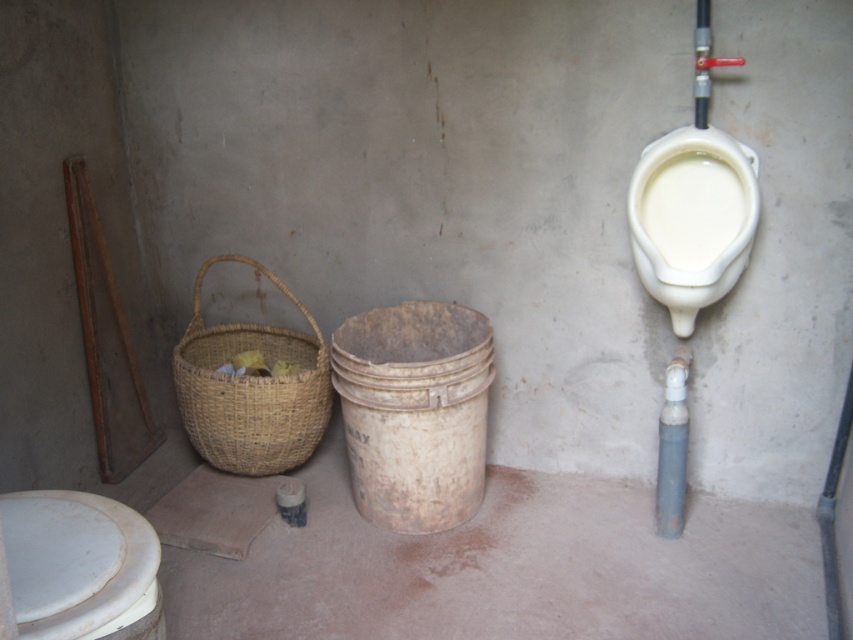
Which is in front, point (85, 563) or point (746, 168)?

Point (85, 563)

Does point (96, 608) come closer to viewer compared to point (753, 227)?

Yes, point (96, 608) is closer to viewer.

What do you see at coordinates (80, 566) in the screenshot? This screenshot has height=640, width=853. I see `white glossy toilet bowl at lower left` at bounding box center [80, 566].

Find the location of a particular element. The height and width of the screenshot is (640, 853). white glossy toilet bowl at lower left is located at coordinates (80, 566).

Does white glossy toilet bowl at lower left have a lesser height compared to woven straw basket at lower left?

Indeed, white glossy toilet bowl at lower left has a lesser height compared to woven straw basket at lower left.

Can you confirm if white glossy toilet bowl at lower left is thinner than woven straw basket at lower left?

Indeed, white glossy toilet bowl at lower left has a lesser width compared to woven straw basket at lower left.

Locate an element on the screen. white glossy toilet bowl at lower left is located at coordinates (80, 566).

Which of these two, woven straw basket at lower left or white glossy urinal at upper right, stands shorter?

white glossy urinal at upper right

Is woven straw basket at lower left shorter than white glossy urinal at upper right?

In fact, woven straw basket at lower left may be taller than white glossy urinal at upper right.

Is point (207, 332) closer to camera compared to point (654, 268)?

No.

Where is `woven straw basket at lower left`? The image size is (853, 640). woven straw basket at lower left is located at coordinates (251, 388).